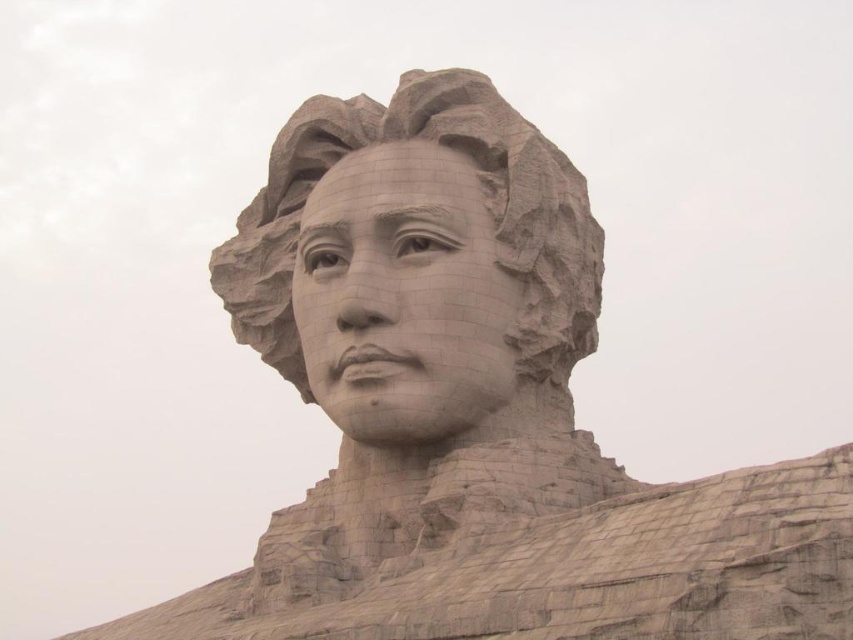
Is matte stone face at center wider than gray stone sculpture at center?

No, matte stone face at center is not wider than gray stone sculpture at center.

How much distance is there between matte stone face at center and gray stone sculpture at center?

matte stone face at center is 4.76 meters away from gray stone sculpture at center.

Who is more forward, (326, 268) or (314, 161)?

Point (326, 268) is in front.

I want to click on matte stone face at center, so click(x=403, y=296).